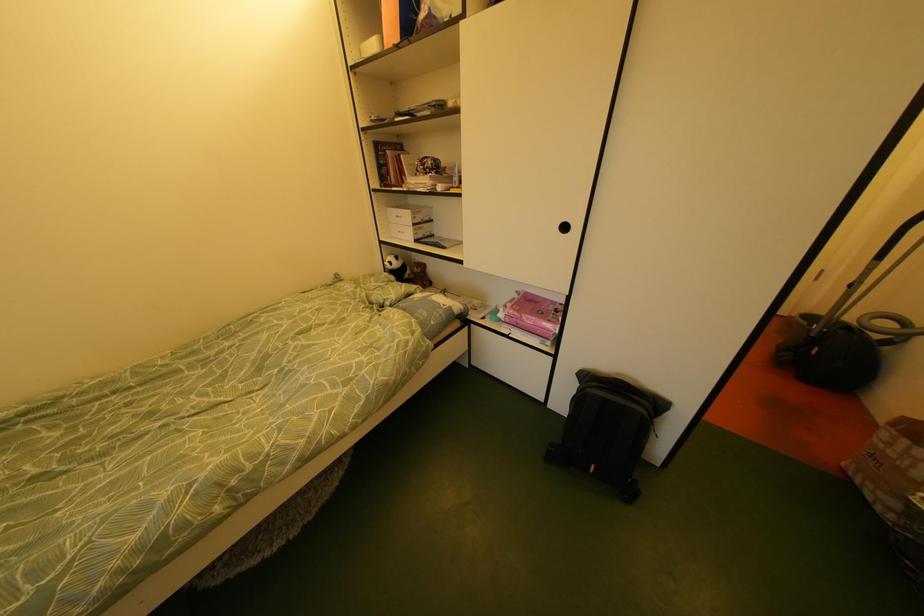
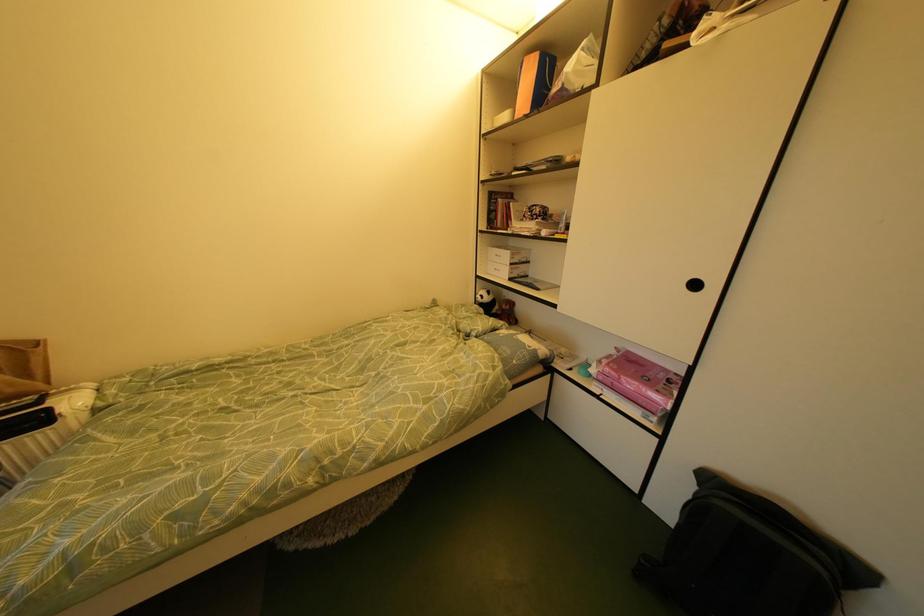
Which direction would the cameraman need to move to produce the second image?

The movement direction of the cameraman is left, backward.